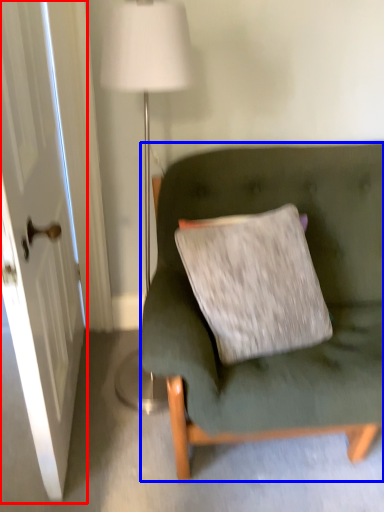
Question: Which object is closer to the camera taking this photo, door (highlighted by a red box) or studio couch (highlighted by a blue box)?

Choices:
 (A) door
 (B) studio couch

Answer: (A)